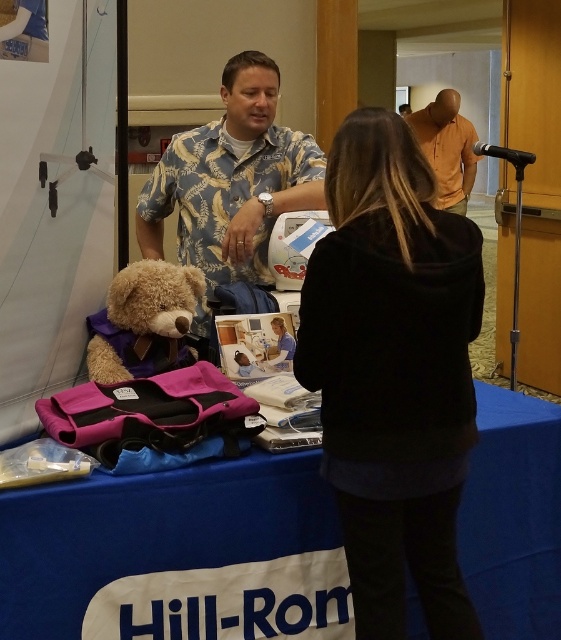
Which is below, blue fabric table at lower center or orange cotton shirt at upper center?

blue fabric table at lower center

Is the position of blue fabric table at lower center more distant than that of orange cotton shirt at upper center?

No, blue fabric table at lower center is closer to the viewer.

Who is more forward, (123, 497) or (466, 173)?

Point (123, 497) is more forward.

Identify the location of blue fabric table at lower center. (174, 554).

Who is higher up, blue fabric table at lower center or fuzzy brown teddy bear at center?

fuzzy brown teddy bear at center is higher up.

Between blue fabric table at lower center and fuzzy brown teddy bear at center, which one is positioned lower?

blue fabric table at lower center is lower down.

Does point (29, 604) come farther from viewer compared to point (197, 282)?

No, it is not.

Identify the location of blue fabric table at lower center. The image size is (561, 640). (174, 554).

Consider the image. Who is more forward, (346, 292) or (163, 296)?

Point (346, 292) is more forward.

Does black fleece jacket at center have a smaller size compared to fuzzy brown teddy bear at center?

Actually, black fleece jacket at center might be larger than fuzzy brown teddy bear at center.

Is point (394, 461) farther from camera compared to point (100, 352)?

That is False.

Identify the location of black fleece jacket at center. (393, 372).